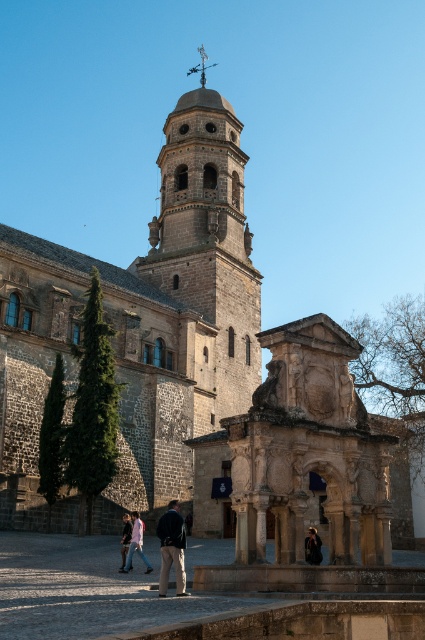
Which is more to the right, dark blue fabric jacket at center or dark blue jeans at lower left?

dark blue fabric jacket at center is more to the right.

Consider the image. Does dark blue fabric jacket at center lie behind dark blue jeans at lower left?

No, dark blue fabric jacket at center is closer to the viewer.

Does point (181, 518) come in front of point (125, 515)?

Yes, it is in front of point (125, 515).

Locate an element on the screen. dark blue fabric jacket at center is located at coordinates click(x=172, y=548).

Who is more distant from viewer, (175,552) or (311,554)?

The point (311,554) is more distant.

In the scene shown: Which is more to the right, dark blue fabric jacket at center or dark brown leather jacket at center?

dark brown leather jacket at center is more to the right.

Identify the location of dark blue fabric jacket at center. This screenshot has height=640, width=425. (172, 548).

Does dark blue fabric jacket at center have a larger size compared to light blue denim jacket at lower left?

Yes, dark blue fabric jacket at center is bigger than light blue denim jacket at lower left.

Which is behind, point (175, 577) or point (130, 515)?

The point (130, 515) is behind.

Who is more forward, [181,573] or [130,544]?

Point [181,573] is in front.

Find the location of a particular element. Image resolution: width=425 pixels, height=640 pixels. dark blue fabric jacket at center is located at coordinates (172, 548).